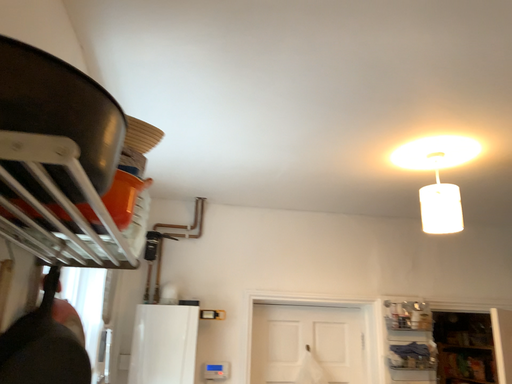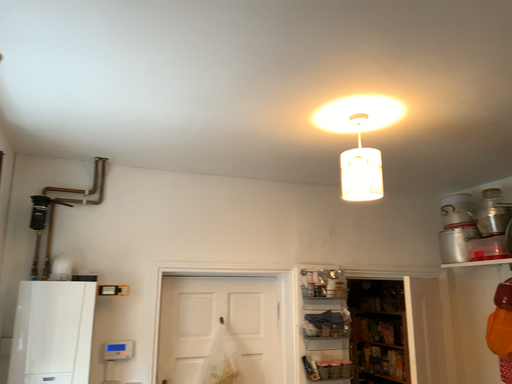
Question: Which way did the camera rotate in the video?

Choices:
 (A) rotated left
 (B) rotated right

Answer: (B)